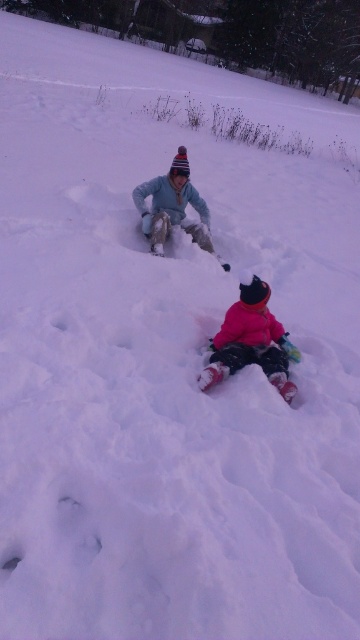
You are a parent trying to find your children in the snow. You see two children wearing the fluffy pink snowsuit at lower center and the light blue fabric snowsuit at center. Which child is wearing the smaller snowsuit?

The fluffy pink snowsuit at lower center is smaller than the light blue fabric snowsuit at center, so the child wearing the fluffy pink snowsuit at lower center has the smaller snowsuit.

You are a parent trying to locate your children in the snowy scene. You see the fluffy pink snowsuit at lower center and the light blue fabric snowsuit at center. Which child is closer to the ground?

The fluffy pink snowsuit at lower center is positioned under light blue fabric snowsuit at center, so the fluffy pink snowsuit at lower center is closer to the ground.

You are standing in the snowy scene and want to walk to the child wearing a bright pink jacket. Which point, point (219, 371) or point (174, 205), is closer to you?

Point (219, 371) is closer to the viewer, so you should head towards that point to reach the child wearing the bright pink jacket.